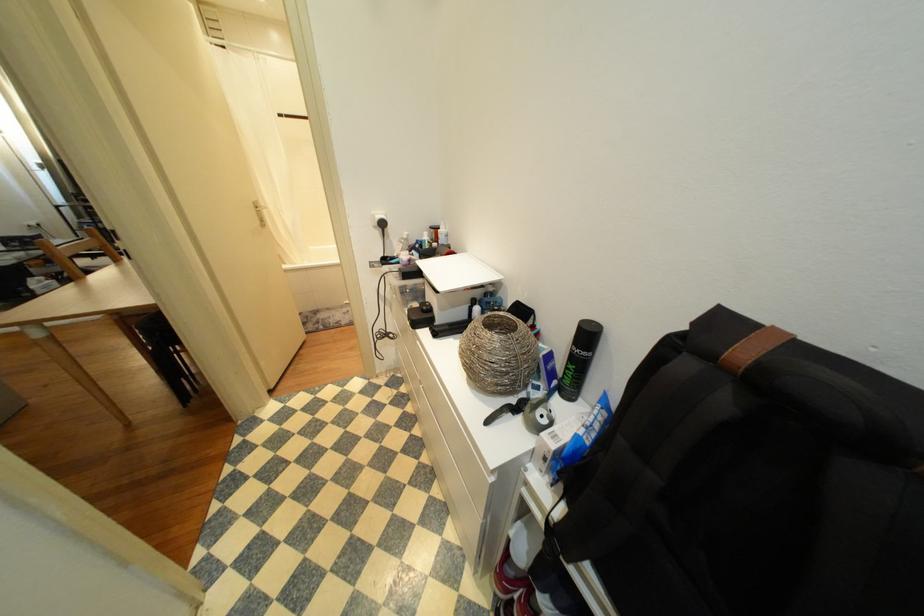
Find the location of `white door handle`. white door handle is located at coordinates (259, 213).